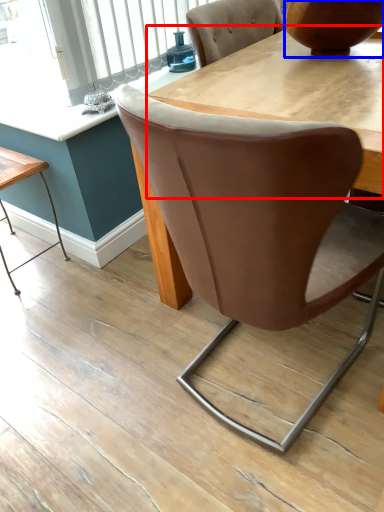
Question: Which object appears farthest to the camera in this image, round table (highlighted by a red box) or vase (highlighted by a blue box)?

Choices:
 (A) round table
 (B) vase

Answer: (B)